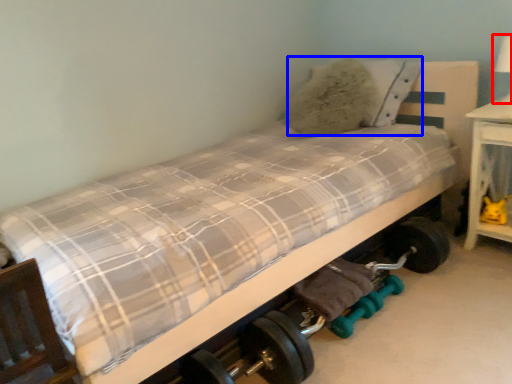
Question: Which of the following is the closest to the observer, table lamp (highlighted by a red box) or pillow (highlighted by a blue box)?

Choices:
 (A) table lamp
 (B) pillow

Answer: (A)